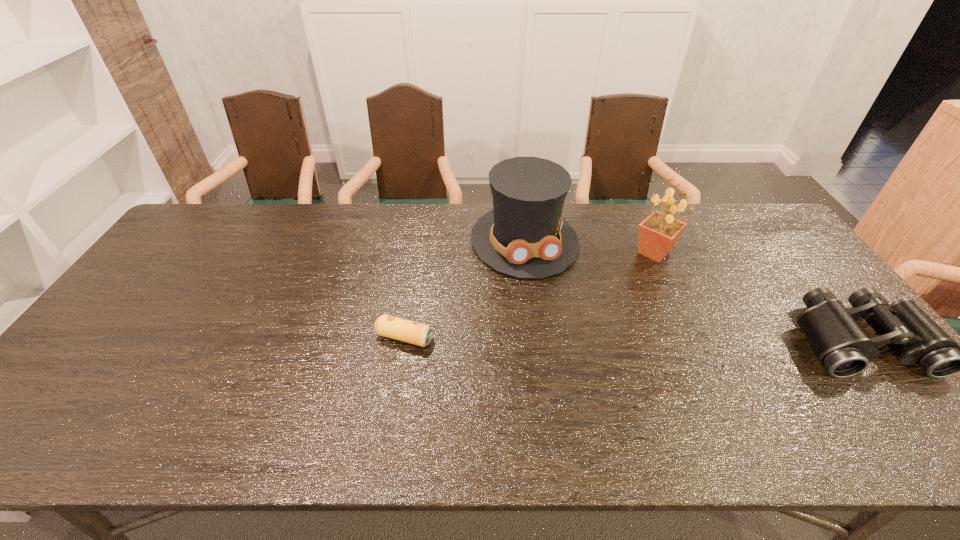
This screenshot has width=960, height=540. Find the location of `vacant point at the near edge`. vacant point at the near edge is located at coordinates (291, 408).

Find the location of `vacant region at the right edge of the desktop`. vacant region at the right edge of the desktop is located at coordinates (783, 276).

Where is `vacant region between the second object from left to right and the sunflower`? vacant region between the second object from left to right and the sunflower is located at coordinates (589, 246).

Identify the location of free area in between the beer can and the sunflower. The height and width of the screenshot is (540, 960). (529, 295).

In order to click on vacant space that's between the dress hat and the leftmost object in this screenshot , I will do `click(465, 289)`.

The width and height of the screenshot is (960, 540). What are the coordinates of `free space that is in between the third object from left to right and the third object from right to left` in the screenshot? It's located at (589, 246).

The height and width of the screenshot is (540, 960). I want to click on free spot between the third object from right to left and the sunflower, so click(x=589, y=246).

Where is `vacant point located between the binoculars and the sunflower`? Image resolution: width=960 pixels, height=540 pixels. vacant point located between the binoculars and the sunflower is located at coordinates (756, 296).

Image resolution: width=960 pixels, height=540 pixels. I want to click on vacant area that lies between the sunflower and the rightmost object, so click(756, 296).

The width and height of the screenshot is (960, 540). I want to click on free space that is in between the binoculars and the dress hat, so click(691, 290).